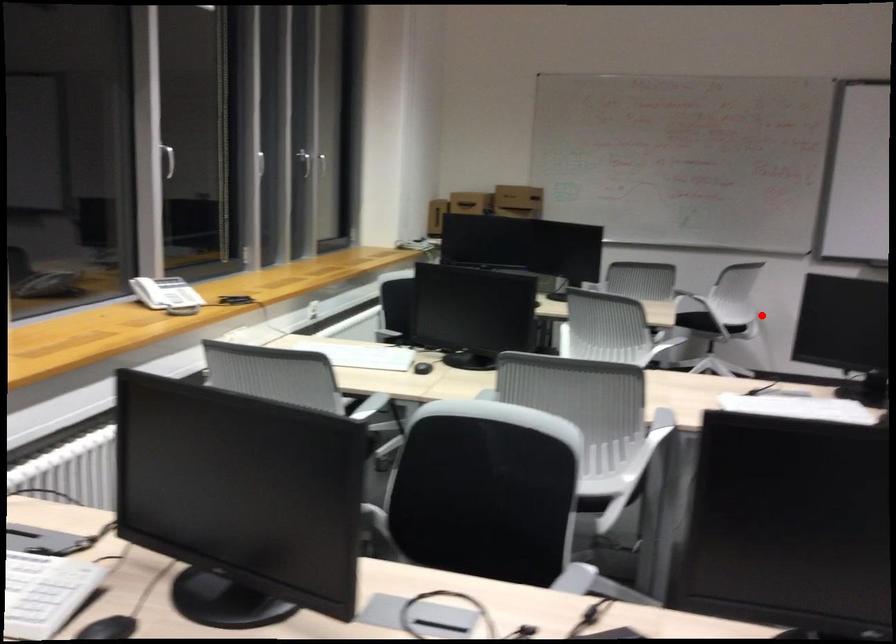
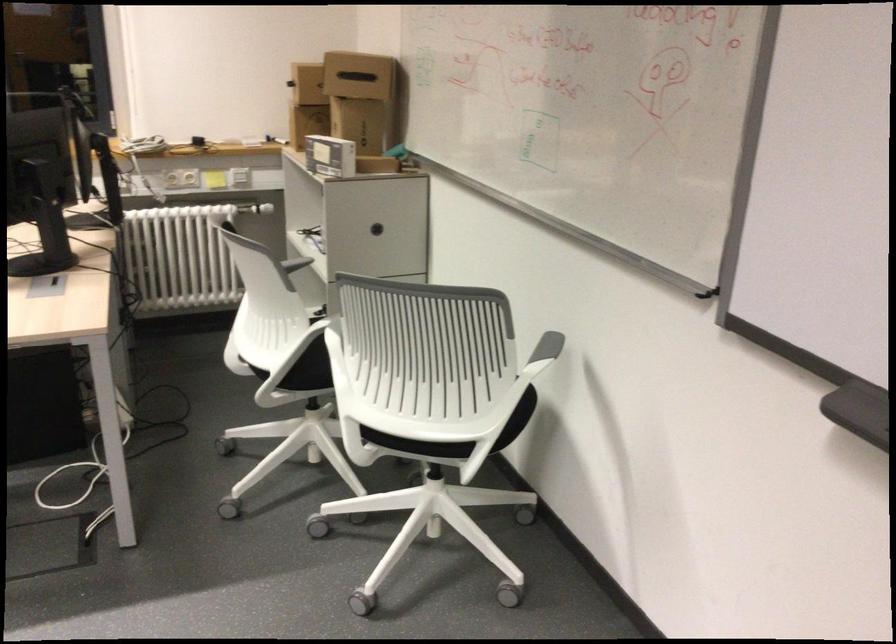
Find the pixel in the second image that matches the highlighted location in the first image.

(418, 444)